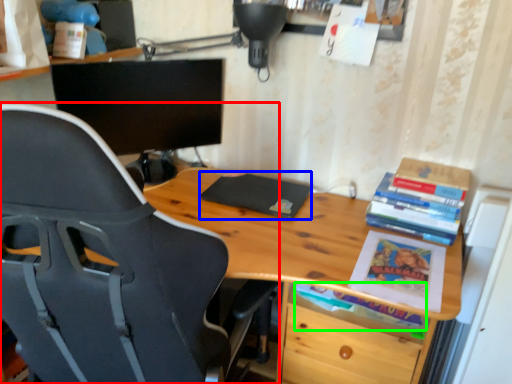
Question: Estimate the real-world distances between objects in this image. Which object is closer to chair (highlighted by a red box), paperback book (highlighted by a blue box) or book (highlighted by a green box)?

Choices:
 (A) paperback book
 (B) book

Answer: (B)